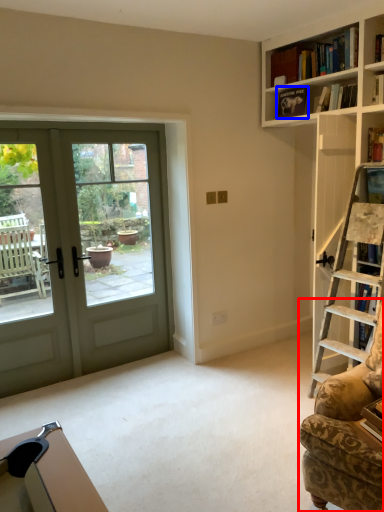
Question: Which object is further to the camera taking this photo, rocking chair (highlighted by a red box) or book (highlighted by a blue box)?

Choices:
 (A) rocking chair
 (B) book

Answer: (B)